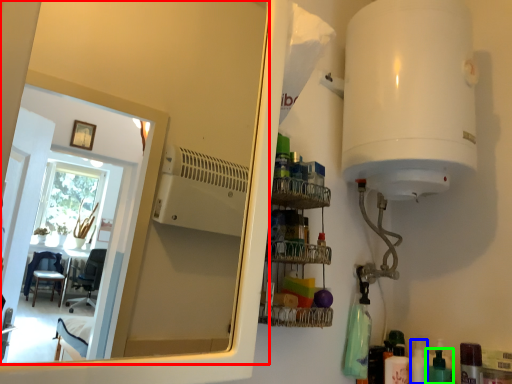
Question: Based on their relative distances, which object is farther from mirror (highlighted by a red box)? Choose from toiletry (highlighted by a blue box) and toiletry (highlighted by a green box).

Choices:
 (A) toiletry
 (B) toiletry

Answer: (B)